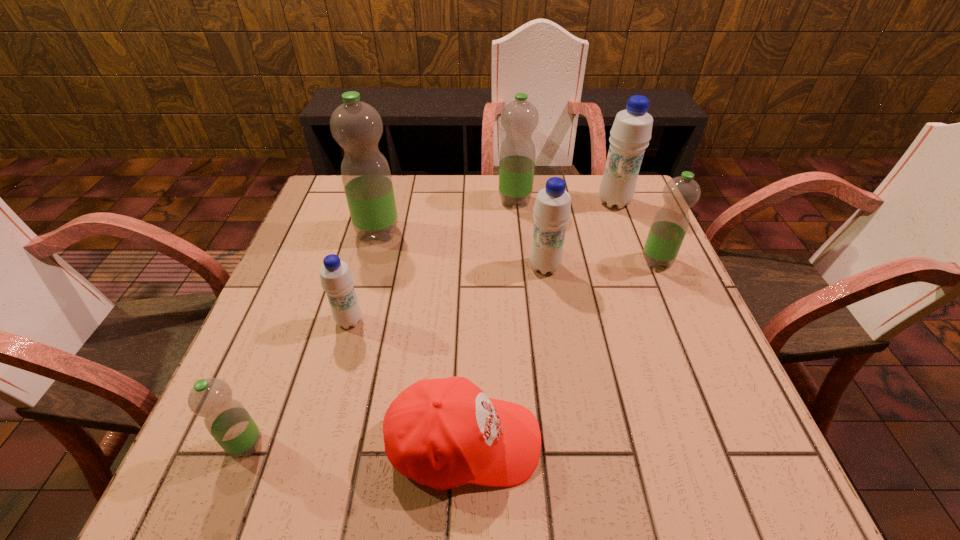
Identify the location of free space at the right edge of the desktop. This screenshot has width=960, height=540. (638, 307).

This screenshot has width=960, height=540. In the image, there is a desktop. Identify the location of vacant space at the near left corner. (295, 447).

At what (x,y) coordinates should I click in order to perform the action: click on empty location between the leftmost object and the shortest object. Please return your answer as a coordinate pair (x, y). Looking at the image, I should click on (355, 443).

The width and height of the screenshot is (960, 540). I want to click on free space between the third green water bottle from right to left and the second biggest blue water bottle, so click(461, 249).

Where is `vacant space that is in between the baseball cap and the second farthest blue water bottle`? Image resolution: width=960 pixels, height=540 pixels. vacant space that is in between the baseball cap and the second farthest blue water bottle is located at coordinates (505, 355).

At what (x,y) coordinates should I click in order to perform the action: click on empty location between the baseball cap and the second nearest green water bottle. Please return your answer as a coordinate pair (x, y). The image size is (960, 540). Looking at the image, I should click on tap(561, 352).

Locate an element on the screen. free spot between the rightmost blue water bottle and the shortest object is located at coordinates (540, 322).

Where is `vacant area that lies between the leftmost blue water bottle and the shortest object`? vacant area that lies between the leftmost blue water bottle and the shortest object is located at coordinates (407, 382).

Identify the location of free spot between the second farthest blue water bottle and the third farthest object. (461, 249).

The height and width of the screenshot is (540, 960). Find the location of `vacant space that's between the second farthest blue water bottle and the farthest green water bottle`. vacant space that's between the second farthest blue water bottle and the farthest green water bottle is located at coordinates (530, 233).